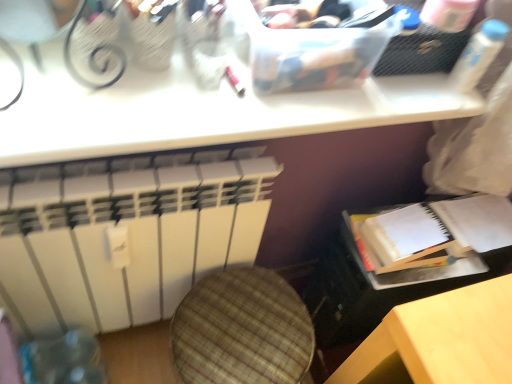
Locate an element on the screen. This screenshot has height=384, width=512. free location above plaid fabric swivel chair at lower left (from a real-world perspective) is located at coordinates (240, 330).